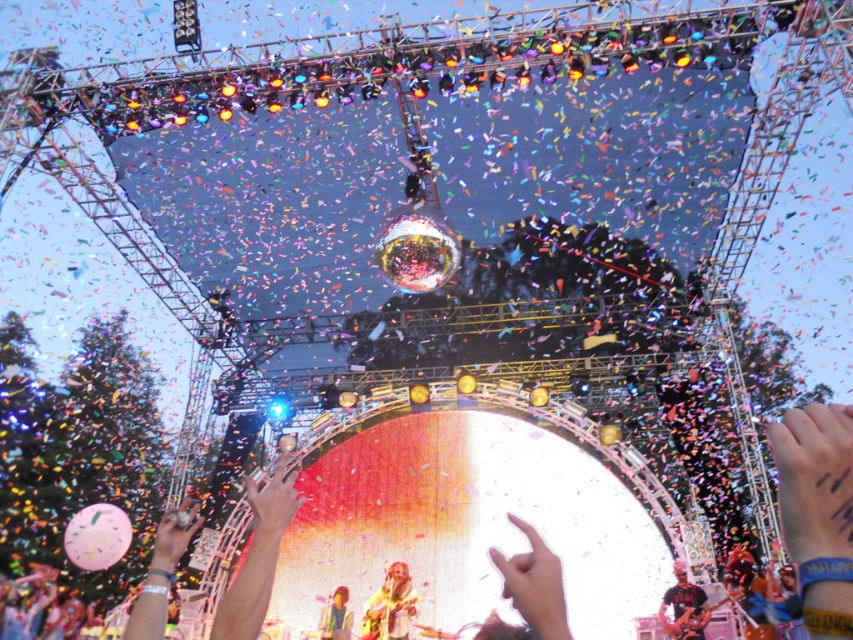
You are a photographer at the concert aiming to capture the yellow fabric hand at center and the matte black shirt at lower right in the same frame. Based on their positions, which object should you focus on first to ensure both are in the shot?

The yellow fabric hand at center is to the left of matte black shirt at lower right, so you should focus on the yellow fabric hand at center first to ensure both are in the shot.

You are a photographer standing at the front of the stage. You notice two points in the image at coordinates point (399, 636) and point (695, 598). Which point would appear closer to you when looking through your camera lens?

Point (399, 636) is further to the camera than point (695, 598), so the point (399, 636) would appear closer to you when looking through your camera lens.